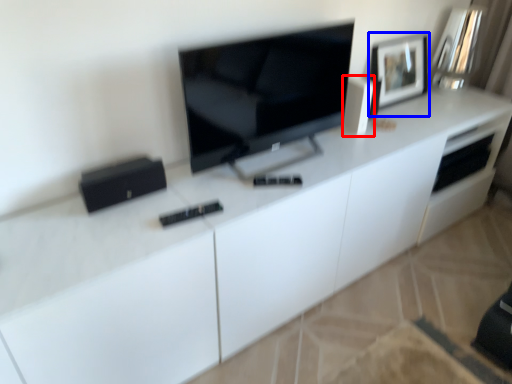
Question: Which object is further to the camera taking this photo, appliance (highlighted by a red box) or picture frame (highlighted by a blue box)?

Choices:
 (A) appliance
 (B) picture frame

Answer: (B)